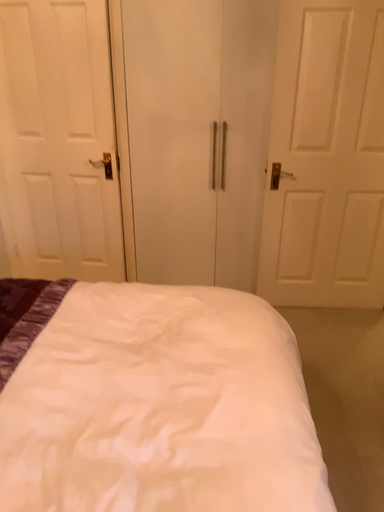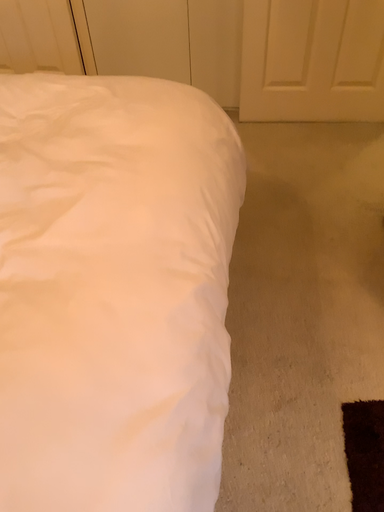
Question: Which way did the camera rotate in the video?

Choices:
 (A) rotated upward
 (B) rotated downward

Answer: (B)